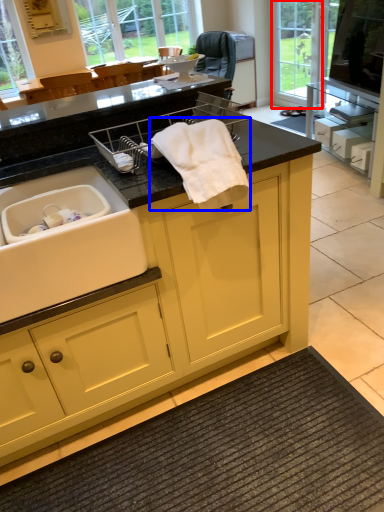
Question: Which object appears farthest to the camera in this image, glass door (highlighted by a red box) or bath towel (highlighted by a blue box)?

Choices:
 (A) glass door
 (B) bath towel

Answer: (A)